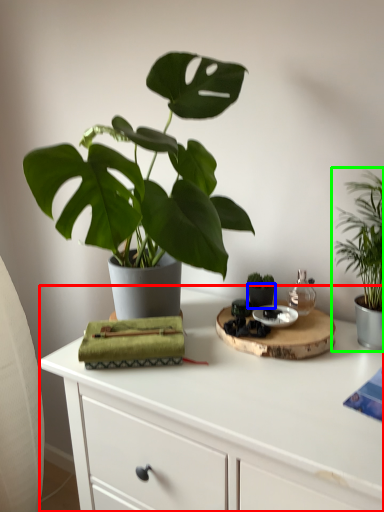
Question: Which is nearer to the table (highlighted by a red box)? flowerpot (highlighted by a blue box) or houseplant (highlighted by a green box).

Choices:
 (A) flowerpot
 (B) houseplant

Answer: (A)